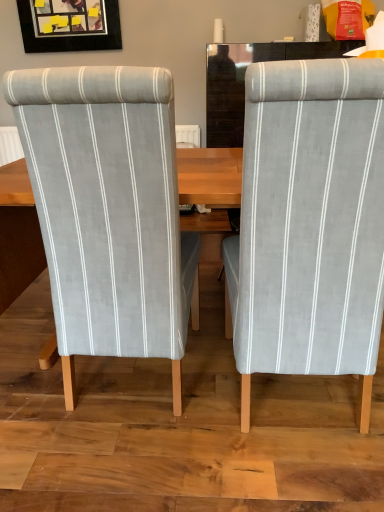
Describe the element at coordinates (309, 224) in the screenshot. The height and width of the screenshot is (512, 384). I see `light gray fabric chair at right, acting as the 1th chair starting from the right` at that location.

At what (x,y) coordinates should I click in order to perform the action: click on matte black picture frame at upper left. Please return your answer as a coordinate pair (x, y). Looking at the image, I should click on (69, 25).

Find the location of a particular element. light gray fabric chair at right, which is the second chair in left-to-right order is located at coordinates (309, 224).

Is matte black picture frame at upper left bigger or smaller than light gray fabric chair at left, the first chair in the left-to-right sequence?

Clearly, matte black picture frame at upper left is smaller in size than light gray fabric chair at left, the first chair in the left-to-right sequence.

From a real-world perspective, is matte black picture frame at upper left positioned over light gray fabric chair at left, the first chair in the left-to-right sequence, based on gravity?

Indeed, from a real-world perspective, matte black picture frame at upper left stands above light gray fabric chair at left, the first chair in the left-to-right sequence.

Can you confirm if matte black picture frame at upper left is wider than light gray fabric chair at left, the 2th chair positioned from the right?

Incorrect, the width of matte black picture frame at upper left does not surpass that of light gray fabric chair at left, the 2th chair positioned from the right.

Between light gray fabric chair at right, acting as the 1th chair starting from the right, and light gray fabric chair at left, the 2th chair positioned from the right, which one is positioned behind?

light gray fabric chair at left, the 2th chair positioned from the right, is further away from the camera.

Considering the positions of objects light gray fabric chair at right, acting as the 1th chair starting from the right, and light gray fabric chair at left, the 2th chair positioned from the right, in the image provided, who is more to the right, light gray fabric chair at right, acting as the 1th chair starting from the right, or light gray fabric chair at left, the 2th chair positioned from the right,?

Positioned to the right is light gray fabric chair at right, acting as the 1th chair starting from the right.

Considering the relative sizes of light gray fabric chair at right, which is the second chair in left-to-right order, and light gray fabric chair at left, the 2th chair positioned from the right, in the image provided, is light gray fabric chair at right, which is the second chair in left-to-right order, smaller than light gray fabric chair at left, the 2th chair positioned from the right,?

Yes, light gray fabric chair at right, which is the second chair in left-to-right order, is smaller than light gray fabric chair at left, the 2th chair positioned from the right.

Who is shorter, light gray fabric chair at right, which is the second chair in left-to-right order, or light gray fabric chair at left, the first chair in the left-to-right sequence?

Standing shorter between the two is light gray fabric chair at left, the first chair in the left-to-right sequence.

Do you think light gray fabric chair at left, the 2th chair positioned from the right, is within matte black picture frame at upper left, or outside of it?

light gray fabric chair at left, the 2th chair positioned from the right, is located beyond the bounds of matte black picture frame at upper left.

Is light gray fabric chair at left, the first chair in the left-to-right sequence, closer to the viewer compared to matte black picture frame at upper left?

Yes, the depth of light gray fabric chair at left, the first chair in the left-to-right sequence, is less than that of matte black picture frame at upper left.

Can you tell me how much light gray fabric chair at left, the 2th chair positioned from the right, and matte black picture frame at upper left differ in facing direction?

The angle between the facing direction of light gray fabric chair at left, the 2th chair positioned from the right, and the facing direction of matte black picture frame at upper left is 178 degrees.

Considering the sizes of objects light gray fabric chair at left, the 2th chair positioned from the right, and matte black picture frame at upper left in the image provided, who is taller, light gray fabric chair at left, the 2th chair positioned from the right, or matte black picture frame at upper left?

With more height is light gray fabric chair at left, the 2th chair positioned from the right.

Based on the photo, is matte black picture frame at upper left shorter than light gray fabric chair at right, which is the second chair in left-to-right order?

Yes, matte black picture frame at upper left is shorter than light gray fabric chair at right, which is the second chair in left-to-right order.

Can you confirm if matte black picture frame at upper left is smaller than light gray fabric chair at right, which is the second chair in left-to-right order?

Correct, matte black picture frame at upper left occupies less space than light gray fabric chair at right, which is the second chair in left-to-right order.

Would you consider matte black picture frame at upper left to be distant from light gray fabric chair at right, acting as the 1th chair starting from the right?

Yes, matte black picture frame at upper left is far from light gray fabric chair at right, acting as the 1th chair starting from the right.

Is light gray fabric chair at right, acting as the 1th chair starting from the right, inside light gray fabric chair at left, the first chair in the left-to-right sequence?

No, light gray fabric chair at left, the first chair in the left-to-right sequence, does not contain light gray fabric chair at right, acting as the 1th chair starting from the right.

Does light gray fabric chair at left, the first chair in the left-to-right sequence, have a greater height compared to light gray fabric chair at right, acting as the 1th chair starting from the right?

No, light gray fabric chair at left, the first chair in the left-to-right sequence, is not taller than light gray fabric chair at right, acting as the 1th chair starting from the right.

Is light gray fabric chair at left, the first chair in the left-to-right sequence, in contact with light gray fabric chair at right, which is the second chair in left-to-right order?

No, light gray fabric chair at left, the first chair in the left-to-right sequence, is not in contact with light gray fabric chair at right, which is the second chair in left-to-right order.

Measure the distance from light gray fabric chair at right, which is the second chair in left-to-right order, to matte black picture frame at upper left.

light gray fabric chair at right, which is the second chair in left-to-right order, and matte black picture frame at upper left are 3.22 meters apart.

Looking at this image, what's the angular difference between light gray fabric chair at right, acting as the 1th chair starting from the right, and matte black picture frame at upper left's facing directions?

The angle between the facing direction of light gray fabric chair at right, acting as the 1th chair starting from the right, and the facing direction of matte black picture frame at upper left is 178 degrees.

Is light gray fabric chair at right, which is the second chair in left-to-right order, bigger or smaller than matte black picture frame at upper left?

Clearly, light gray fabric chair at right, which is the second chair in left-to-right order, is larger in size than matte black picture frame at upper left.

Considering their positions, is light gray fabric chair at right, acting as the 1th chair starting from the right, located in front of or behind matte black picture frame at upper left?

In the image, light gray fabric chair at right, acting as the 1th chair starting from the right, appears in front of matte black picture frame at upper left.

Locate an element on the screen. The width and height of the screenshot is (384, 512). picture frame above the light gray fabric chair at left, the 2th chair positioned from the right (from a real-world perspective) is located at coordinates (69, 25).

Where is `chair behind the light gray fabric chair at right, which is the second chair in left-to-right order`? chair behind the light gray fabric chair at right, which is the second chair in left-to-right order is located at coordinates (109, 211).

Considering their positions, is matte black picture frame at upper left positioned closer to light gray fabric chair at left, the 2th chair positioned from the right, than light gray fabric chair at right, which is the second chair in left-to-right order?

The object closer to light gray fabric chair at left, the 2th chair positioned from the right, is light gray fabric chair at right, which is the second chair in left-to-right order.

Which object lies further to the anchor point light gray fabric chair at left, the 2th chair positioned from the right, light gray fabric chair at right, which is the second chair in left-to-right order, or matte black picture frame at upper left?

Among the two, matte black picture frame at upper left is located further to light gray fabric chair at left, the 2th chair positioned from the right.

When comparing their distances from matte black picture frame at upper left, does light gray fabric chair at right, acting as the 1th chair starting from the right, or light gray fabric chair at left, the first chair in the left-to-right sequence, seem further?

The object further to matte black picture frame at upper left is light gray fabric chair at right, acting as the 1th chair starting from the right.

Which object lies further to the anchor point light gray fabric chair at right, which is the second chair in left-to-right order, matte black picture frame at upper left or light gray fabric chair at left, the 2th chair positioned from the right?

The object further to light gray fabric chair at right, which is the second chair in left-to-right order, is matte black picture frame at upper left.

From the image, which object appears to be farther from light gray fabric chair at right, which is the second chair in left-to-right order, light gray fabric chair at left, the first chair in the left-to-right sequence, or matte black picture frame at upper left?

matte black picture frame at upper left.

Considering their positions, is light gray fabric chair at left, the 2th chair positioned from the right, positioned further to matte black picture frame at upper left than light gray fabric chair at right, which is the second chair in left-to-right order?

light gray fabric chair at right, which is the second chair in left-to-right order, is positioned further to the anchor matte black picture frame at upper left.

You are a GUI agent. You are given a task and a screenshot of the screen. Output one action in this format:
    pyautogui.click(x=<x>, y=<y>)
    Task: Click on the chair between light gray fabric chair at right, which is the second chair in left-to-right order, and matte black picture frame at upper left in the front-back direction
    This screenshot has height=512, width=384.
    Given the screenshot: What is the action you would take?
    pyautogui.click(x=109, y=211)